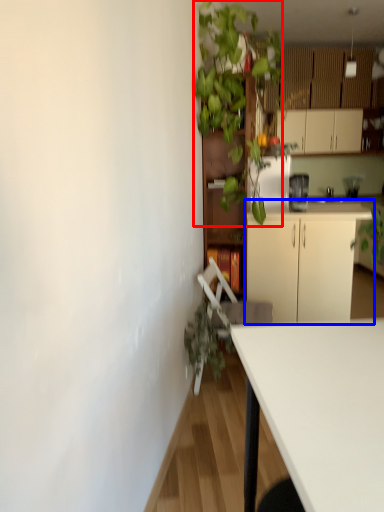
Question: Which of the following is the closest to the observer, vegetation (highlighted by a red box) or cabinetry (highlighted by a blue box)?

Choices:
 (A) vegetation
 (B) cabinetry

Answer: (A)